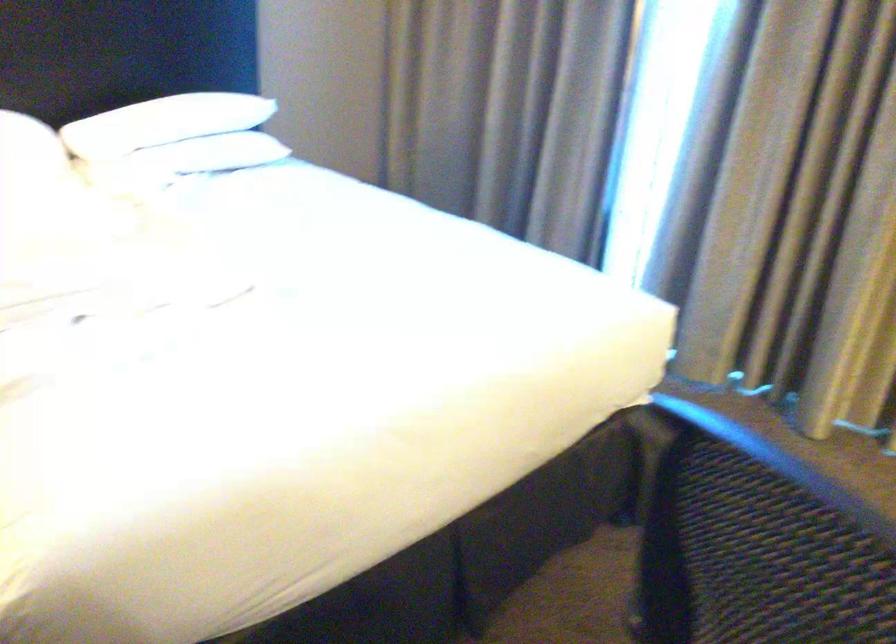
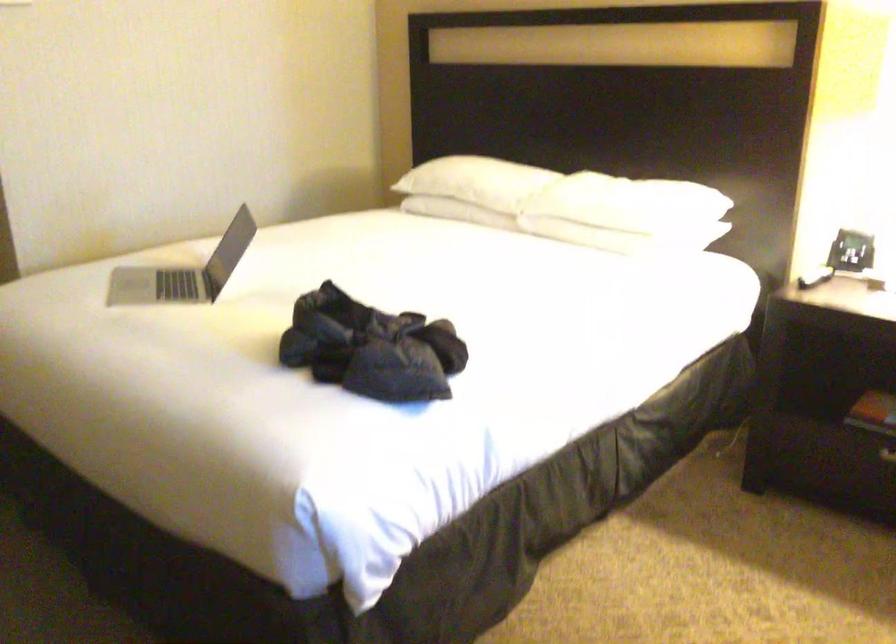
Question: The camera is either moving clockwise (left) or counter-clockwise (right) around the object. The first image is from the beginning of the video and the second image is from the end. Is the camera moving left or right when shooting the video?

Choices:
 (A) Left
 (B) Right

Answer: (B)